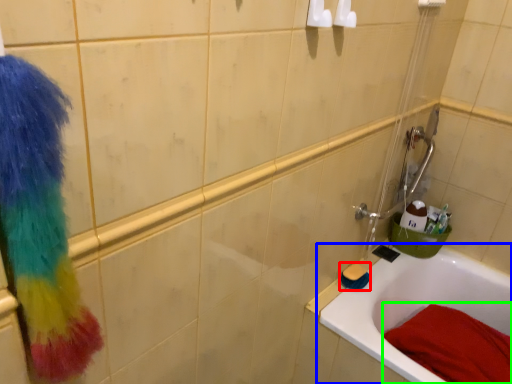
Question: Based on their relative distances, which object is nearer to brush (highlighted by a red box)? Choose from bathtub (highlighted by a blue box) and bath towel (highlighted by a green box).

Choices:
 (A) bathtub
 (B) bath towel

Answer: (A)